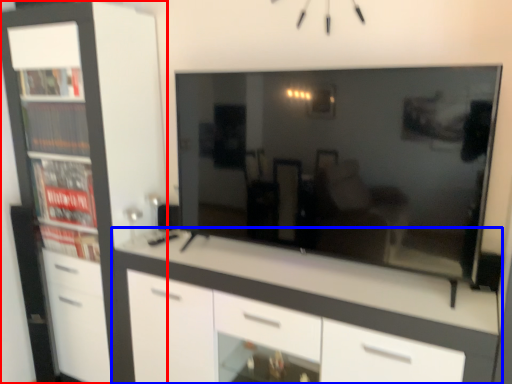
Question: Which of the following is the closest to the observer, cabinetry (highlighted by a red box) or chest of drawers (highlighted by a blue box)?

Choices:
 (A) cabinetry
 (B) chest of drawers

Answer: (B)